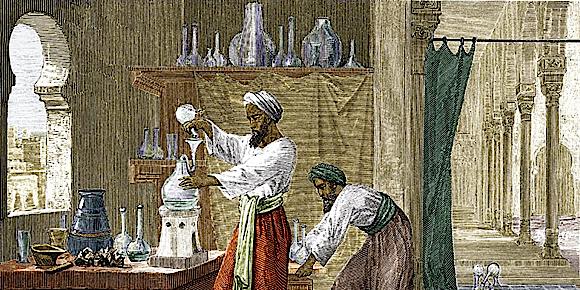
The height and width of the screenshot is (290, 580). Find the location of `window`. window is located at coordinates (44, 134).